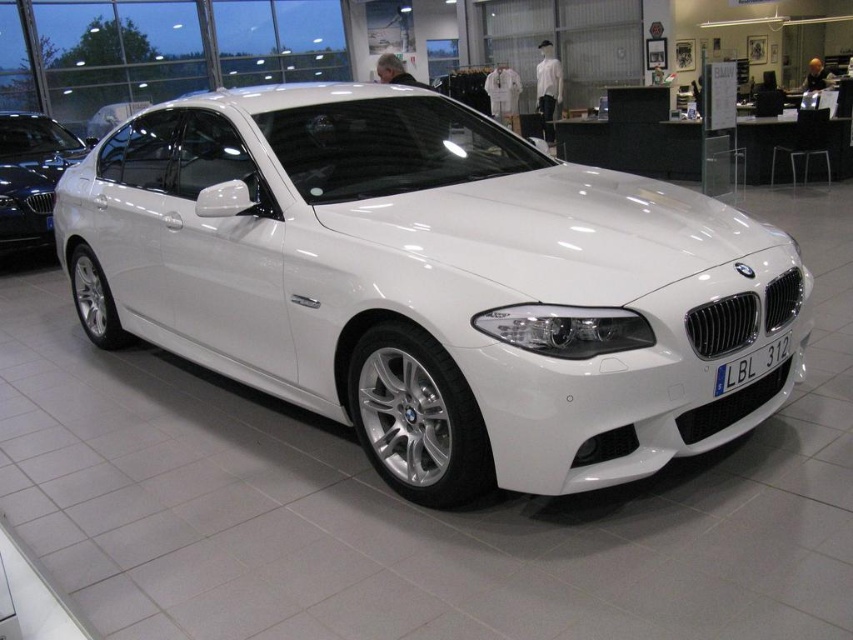
This screenshot has height=640, width=853. What do you see at coordinates (430, 284) in the screenshot?
I see `white glossy car at center` at bounding box center [430, 284].

Which is in front, point (502, 134) or point (721, 396)?

Point (721, 396) is in front.

Describe the element at coordinates (430, 284) in the screenshot. I see `white glossy car at center` at that location.

Locate an element on the screen. Image resolution: width=853 pixels, height=640 pixels. white glossy car at center is located at coordinates (430, 284).

Where is `white glossy sedan at center`? white glossy sedan at center is located at coordinates (32, 176).

Does white glossy sedan at center have a greater height compared to black plastic license plate at front?

Yes, white glossy sedan at center is taller than black plastic license plate at front.

Is point (27, 134) more distant than point (743, 385)?

That is True.

At what (x,y) coordinates should I click in order to perform the action: click on white glossy sedan at center. Please return your answer as a coordinate pair (x, y). Looking at the image, I should click on (32, 176).

Can you confirm if white glossy car at center is positioned to the right of white glossy sedan at center?

Correct, you'll find white glossy car at center to the right of white glossy sedan at center.

Is point (349, 308) farther from camera compared to point (51, 129)?

No, (349, 308) is closer to viewer.

In order to click on white glossy car at center in this screenshot , I will do `click(430, 284)`.